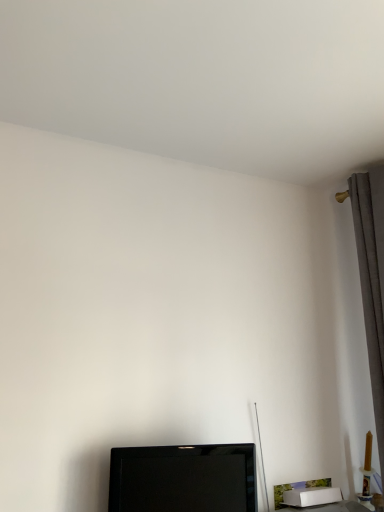
Identify the location of black glossy tv at lower center. (183, 479).

The width and height of the screenshot is (384, 512). What do you see at coordinates (183, 479) in the screenshot?
I see `black glossy tv at lower center` at bounding box center [183, 479].

At what (x,y) coordinates should I click in order to perform the action: click on gray fabric curtain at right. Please return your answer as a coordinate pair (x, y). Looking at the image, I should click on (370, 295).

Image resolution: width=384 pixels, height=512 pixels. Describe the element at coordinates (370, 295) in the screenshot. I see `gray fabric curtain at right` at that location.

This screenshot has height=512, width=384. Find the location of `black glossy tv at lower center`. black glossy tv at lower center is located at coordinates (183, 479).

Which is more to the right, black glossy tv at lower center or gray fabric curtain at right?

From the viewer's perspective, gray fabric curtain at right appears more on the right side.

Does black glossy tv at lower center lie in front of gray fabric curtain at right?

Yes, black glossy tv at lower center is closer to the viewer.

Which is closer to the camera, (198, 472) or (362, 272)?

Point (198, 472).

From the image's perspective, is black glossy tv at lower center above or below gray fabric curtain at right?

Clearly, from the image's perspective, black glossy tv at lower center is below gray fabric curtain at right.

From a real-world perspective, who is located lower, black glossy tv at lower center or gray fabric curtain at right?

black glossy tv at lower center is physically lower.

Which of these two, black glossy tv at lower center or gray fabric curtain at right, is thinner?

Thinner between the two is black glossy tv at lower center.

Can you confirm if black glossy tv at lower center is taller than gray fabric curtain at right?

In fact, black glossy tv at lower center may be shorter than gray fabric curtain at right.

Based on their sizes in the image, would you say black glossy tv at lower center is bigger or smaller than gray fabric curtain at right?

In the image, black glossy tv at lower center appears to be smaller than gray fabric curtain at right.

Is gray fabric curtain at right completely or partially inside black glossy tv at lower center?

That's incorrect, gray fabric curtain at right is not inside black glossy tv at lower center.

Is black glossy tv at lower center far away from gray fabric curtain at right?

That's not correct — black glossy tv at lower center is a little close to gray fabric curtain at right.

Is black glossy tv at lower center positioned with its back to gray fabric curtain at right?

No, black glossy tv at lower center is not facing the opposite direction of gray fabric curtain at right.

There is a black glossy tv at lower center. Where is `curtain above it (from a real-world perspective)`? curtain above it (from a real-world perspective) is located at coordinates (370, 295).

Is gray fabric curtain at right at the right side of black glossy tv at lower center?

Correct, you'll find gray fabric curtain at right to the right of black glossy tv at lower center.

Considering their positions, is gray fabric curtain at right located in front of or behind black glossy tv at lower center?

Visually, gray fabric curtain at right is located behind black glossy tv at lower center.

Does point (367, 279) appear closer or farther from the camera than point (153, 476)?

Clearly, point (367, 279) is more distant from the camera than point (153, 476).

From the image's perspective, is gray fabric curtain at right located above black glossy tv at lower center?

Indeed, from the image's perspective, gray fabric curtain at right is shown above black glossy tv at lower center.

From a real-world perspective, between gray fabric curtain at right and black glossy tv at lower center, who is vertically lower?

black glossy tv at lower center, from a real-world perspective.

Does gray fabric curtain at right have a greater width compared to black glossy tv at lower center?

Correct, the width of gray fabric curtain at right exceeds that of black glossy tv at lower center.

Is gray fabric curtain at right taller or shorter than black glossy tv at lower center?

In the image, gray fabric curtain at right appears to be taller than black glossy tv at lower center.

In terms of size, does gray fabric curtain at right appear bigger or smaller than black glossy tv at lower center?

Clearly, gray fabric curtain at right is larger in size than black glossy tv at lower center.

Would you say gray fabric curtain at right is outside black glossy tv at lower center?

That's correct, gray fabric curtain at right is outside of black glossy tv at lower center.

Looking at this image, does gray fabric curtain at right touch black glossy tv at lower center?

gray fabric curtain at right and black glossy tv at lower center are clearly separated.

Is gray fabric curtain at right oriented towards black glossy tv at lower center?

Yes, gray fabric curtain at right faces towards black glossy tv at lower center.

How many degrees apart are the facing directions of gray fabric curtain at right and black glossy tv at lower center?

They differ by 77.5 degrees in their facing directions.

Image resolution: width=384 pixels, height=512 pixels. I want to click on curtain that appears on the right of black glossy tv at lower center, so click(x=370, y=295).

In the image, there is a gray fabric curtain at right. At what (x,y) coordinates should I click in order to perform the action: click on television below it (from a real-world perspective). Please return your answer as a coordinate pair (x, y). Looking at the image, I should click on (183, 479).

Where is `television on the left of gray fabric curtain at right`? television on the left of gray fabric curtain at right is located at coordinates (183, 479).